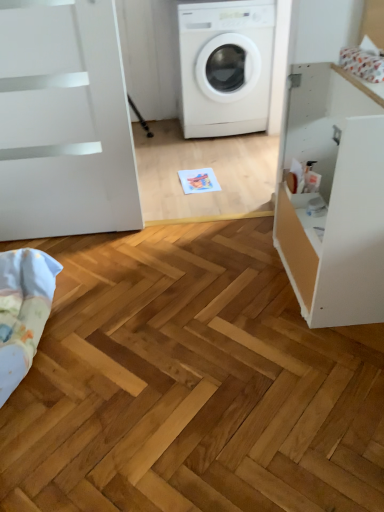
Question: Does point (210, 120) appear closer or farther from the camera than point (46, 272)?

Choices:
 (A) closer
 (B) farther

Answer: (B)

Question: Is white matte washing machine at center in front of or behind light blue cotton blanket at lower left in the image?

Choices:
 (A) behind
 (B) front

Answer: (A)

Question: Estimate the real-world distances between objects in this image. Which object is farther from the light blue cotton blanket at lower left?

Choices:
 (A) white matte cabinet at right
 (B) white matte washing machine at center

Answer: (B)

Question: Which of these objects is positioned closest to the white matte cabinet at right?

Choices:
 (A) white matte washing machine at center
 (B) light blue cotton blanket at lower left

Answer: (B)